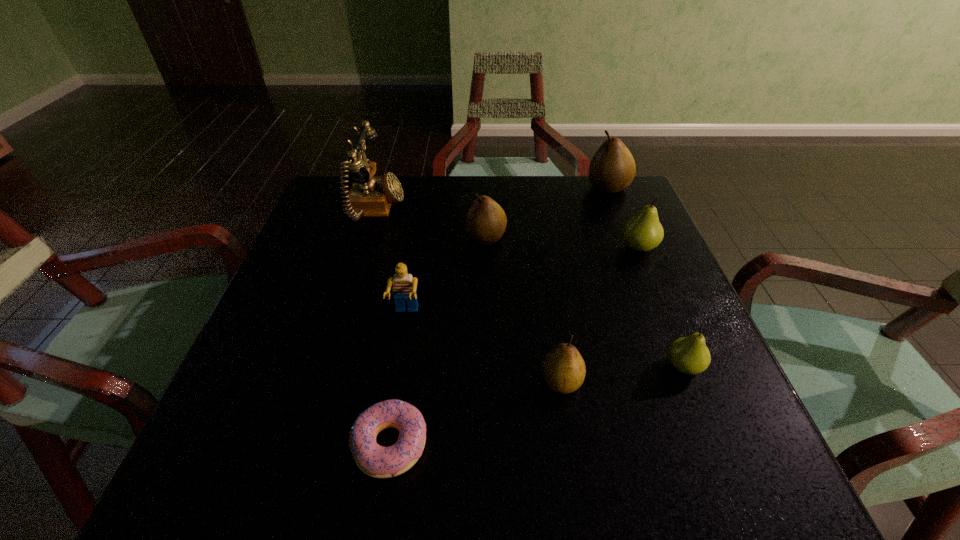
Where is `blank space located on the left of the smallest brown pear`? blank space located on the left of the smallest brown pear is located at coordinates 384,381.

Image resolution: width=960 pixels, height=540 pixels. I want to click on vacant position located 0.270m on the right of the doughnut, so click(x=602, y=444).

You are a GUI agent. You are given a task and a screenshot of the screen. Output one action in this format:
    pyautogui.click(x=<x>, y=<y>)
    Task: Click on the telephone at the far edge
    
    Given the screenshot: What is the action you would take?
    pyautogui.click(x=369, y=196)

Find the location of `object at the near edge`. object at the near edge is located at coordinates (374, 460).

Find the location of a particular element. Image resolution: width=960 pixels, height=540 pixels. object situated at the left edge is located at coordinates (369, 196).

Locate an element on the screen. The image size is (960, 540). object that is at the far left corner is located at coordinates (369, 196).

Locate an element on the screen. This screenshot has height=540, width=960. object positioned at the far right corner is located at coordinates (612, 168).

Identify the location of free space at the far edge of the desktop. This screenshot has height=540, width=960. (407, 206).

This screenshot has height=540, width=960. I want to click on free space at the near edge, so click(x=611, y=460).

You are a GUI agent. You are given a task and a screenshot of the screen. Output one action in this format:
    pyautogui.click(x=<x>, y=<y>)
    Task: Click on the free space at the left edge of the desktop
    The width and height of the screenshot is (960, 540).
    Given the screenshot: What is the action you would take?
    pyautogui.click(x=312, y=327)